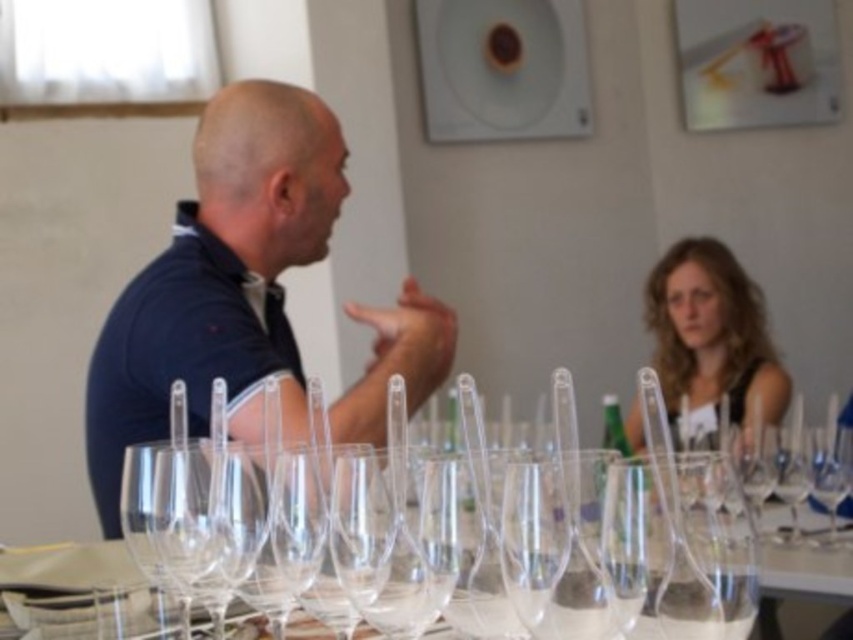
From the picture: You are a photographer setting up a shoot at the wine tasting event. You need to position a spotlight so it can illuminate both the dark blue shirt at left and the blonde hair at upper right without overlapping their light areas. Given that the spotlight can only cover a fixed width, which object should you adjust the spotlight width for first to ensure both are fully illuminated?

The dark blue shirt at left might be wider than blonde hair at upper right, so you should adjust the spotlight width first to accommodate the wider dark blue shirt at left to ensure both are fully illuminated.

You are observing a wine tasting event and notice two people at the table. The man in the dark blue shirt at left is talking to the woman with blonde hair at upper right. Which person appears taller in the image?

The dark blue shirt at left is taller than blonde hair at upper right, so the man in the dark blue shirt at left appears taller in the image.